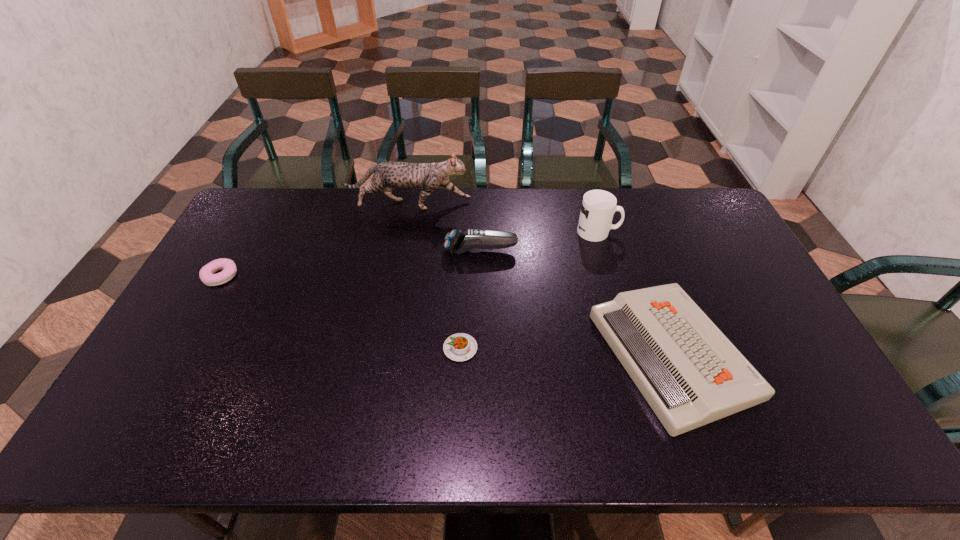
The image size is (960, 540). Identify the location of free space between the tallest object and the third nearest object. (315, 241).

Identify the location of free area in between the tallest object and the fourth nearest object. The height and width of the screenshot is (540, 960). (444, 228).

This screenshot has width=960, height=540. In order to click on free space between the mug and the pudding in this screenshot , I will do `click(529, 290)`.

The image size is (960, 540). Find the location of `vacant point located between the computer keyboard and the shortest object`. vacant point located between the computer keyboard and the shortest object is located at coordinates (566, 352).

Where is `vacant area that lies between the shortest object and the leftmost object`? vacant area that lies between the shortest object and the leftmost object is located at coordinates (341, 312).

Locate an element on the screen. free space between the third shortest object and the farthest object is located at coordinates (540, 280).

The height and width of the screenshot is (540, 960). Find the location of `vacant space that is in between the farthest object and the pudding`. vacant space that is in between the farthest object and the pudding is located at coordinates (434, 277).

Identify the location of unoccupied area between the electric shaver and the farthest object. (444, 228).

Identify which object is located as the fourth nearest to the pudding. Please provide its 2D coordinates. Your answer should be formatted as a tuple, i.e. [(x, y)], where the tuple contains the x and y coordinates of a point satisfying the conditions above.

[(388, 175)]

Where is `the fourth closest object to the pudding`? The width and height of the screenshot is (960, 540). the fourth closest object to the pudding is located at coordinates (388, 175).